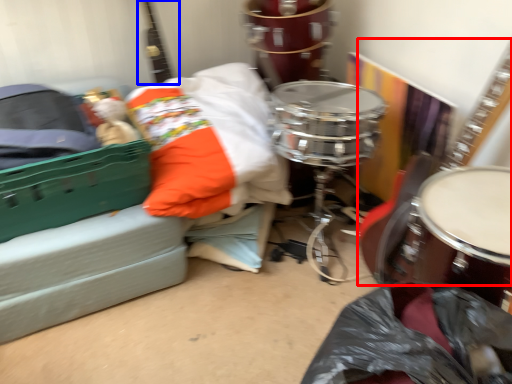
Question: Which object appears farthest to the camera in this image, guitar (highlighted by a red box) or guitar (highlighted by a blue box)?

Choices:
 (A) guitar
 (B) guitar

Answer: (B)